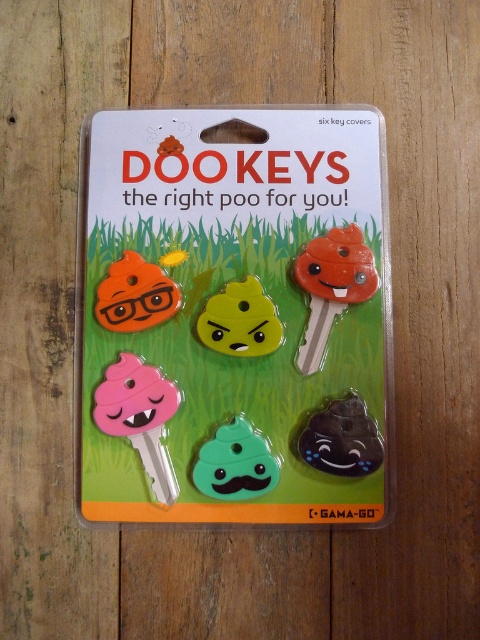
In the scene shown: You are holding the DOOKEYS package and want to place the pink matte key at center and the green rubber poop at center on a shelf. The shelf has a space that is 3.9 inches wide. Can both items fit side by side without overlapping?

The pink matte key at center is 3.97 inches from the green rubber poop at center. Since the total width required is 3.97 inches, which exceeds the 3.9 inch space available, the items cannot fit side by side without overlapping.